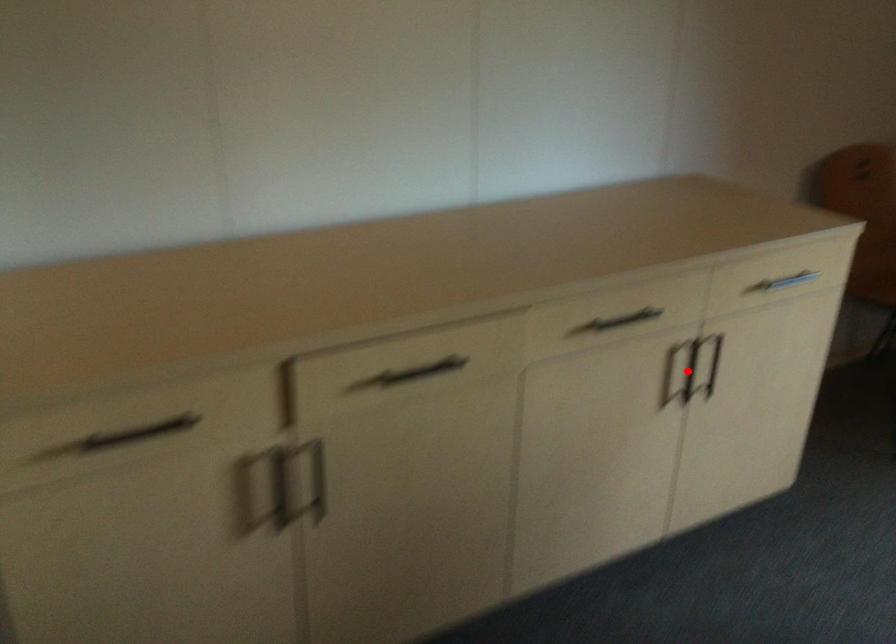
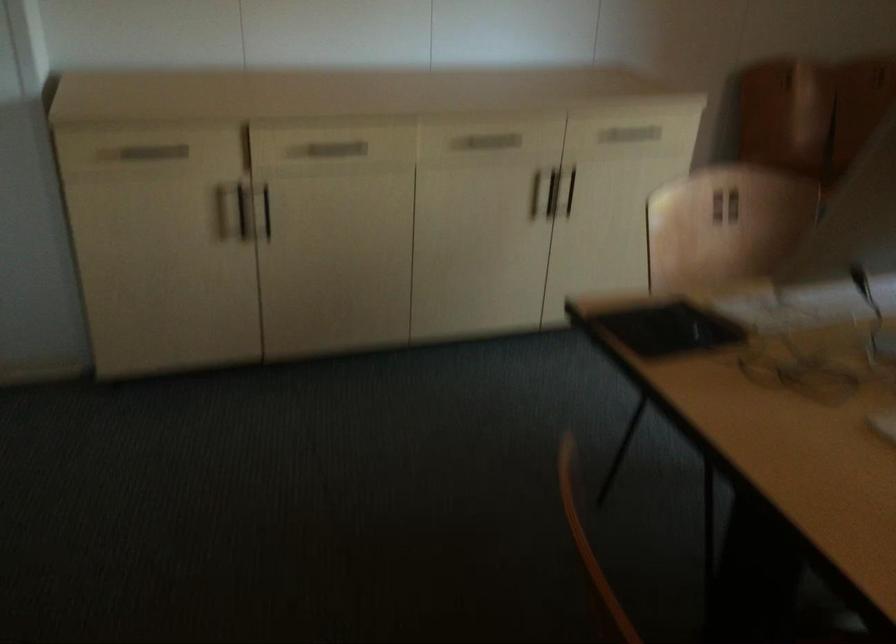
The point at the highlighted location is marked in the first image. Where is the corresponding point in the second image?

(552, 192)